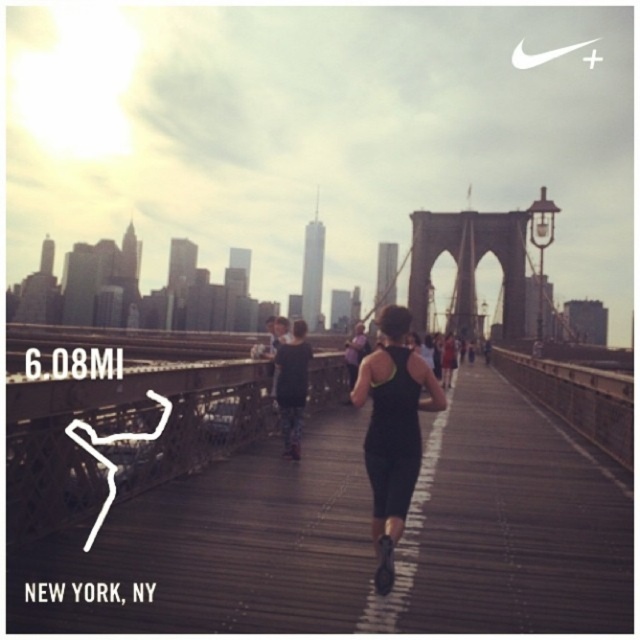
Question: Estimate the real-world distances between objects in this image. Which object is closer to the dark gray stone bridge at center?

Choices:
 (A) floral leggings at center
 (B) black fabric running suit at center
 (C) black matte running suit at center

Answer: (C)

Question: Which object is the closest to the black matte running suit at center?

Choices:
 (A) dark gray stone bridge at center
 (B) floral leggings at center
 (C) black fabric running suit at center

Answer: (C)

Question: Does black matte running suit at center appear on the right side of dark gray stone bridge at center?

Choices:
 (A) yes
 (B) no

Answer: (B)

Question: Is black fabric running suit at center bigger than black matte running suit at center?

Choices:
 (A) no
 (B) yes

Answer: (B)

Question: Where is black fabric running suit at center located in relation to floral leggings at center in the image?

Choices:
 (A) below
 (B) above

Answer: (A)

Question: Among these points, which one is nearest to the camera?

Choices:
 (A) (308, 356)
 (B) (492, 416)
 (C) (509, 332)
 (D) (387, 392)

Answer: (D)